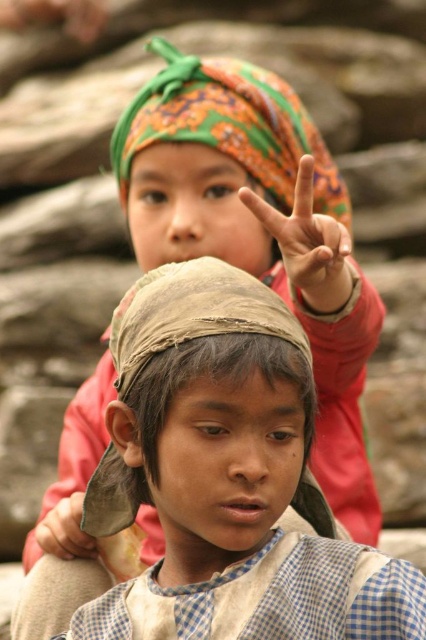
You are a photographer trying to capture a photo of the two children. The matte fabric hand at upper center and the matte brown hand at center are part of the scene. Given that your camera has a maximum focus range of 10 feet, will both hands be in focus?

The matte fabric hand at upper center is 10.64 feet from matte brown hand at center. Since the distance between them exceeds the camera maximum focus range of 10 feet, the hands will not both be in focus.

You are a photographer trying to capture both the brown textured cloth at center and the matte brown hand at center in a single frame. Given their sizes, which object should you focus on to ensure both fit in the frame without cropping?

Since the brown textured cloth at center is wider than the matte brown hand at center, you should focus on centering the brown textured cloth at center to ensure both objects fit within the frame.